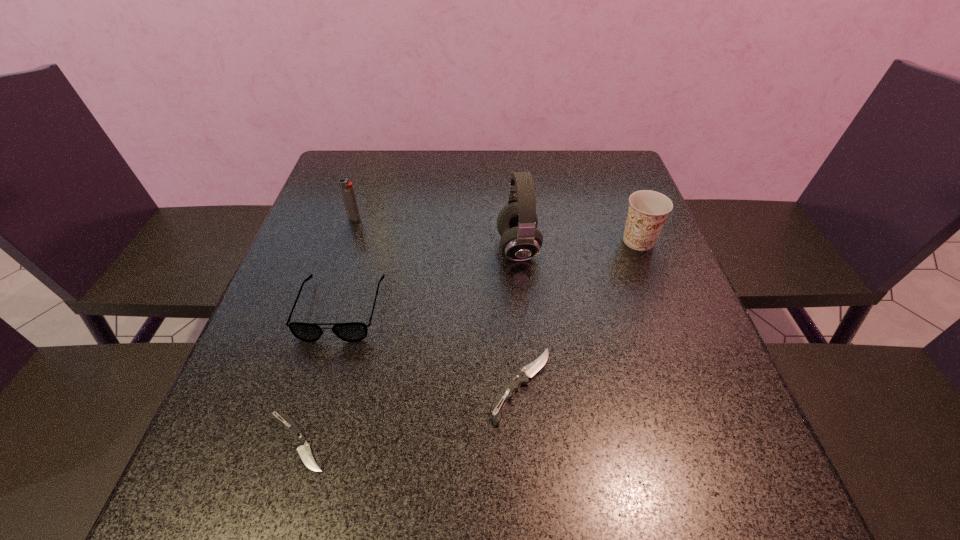
You are a GUI agent. You are given a task and a screenshot of the screen. Output one action in this format:
    pyautogui.click(x=<x>, y=<y>)
    Task: Click on the object situated at the right edge
    This screenshot has height=540, width=960.
    Given the screenshot: What is the action you would take?
    pyautogui.click(x=648, y=210)

Image resolution: width=960 pixels, height=540 pixels. Identify the location of object that is positioned at the near left corner. (303, 448).

Find the location of `vacant space at the far edge of the desktop`. vacant space at the far edge of the desktop is located at coordinates (471, 181).

I want to click on vacant space at the near edge, so pos(411,402).

In order to click on vacant space at the left edge of the desktop in this screenshot , I will do pyautogui.click(x=312, y=244).

The image size is (960, 540). Identify the location of blank area at the right edge. (615, 237).

Identify the location of free space at the far left corner of the desktop. (349, 179).

In the image, there is a desktop. Identify the location of vacant space at the near left corner. (253, 395).

Identify the location of free space at the far right corner of the desktop. This screenshot has width=960, height=540. (631, 167).

You are a GUI agent. You are given a task and a screenshot of the screen. Output one action in this format:
    pyautogui.click(x=<x>, y=<y>)
    Task: Click on the vacant space that is in between the fourth farthest object and the Dixie cup
    
    Given the screenshot: What is the action you would take?
    pyautogui.click(x=490, y=275)